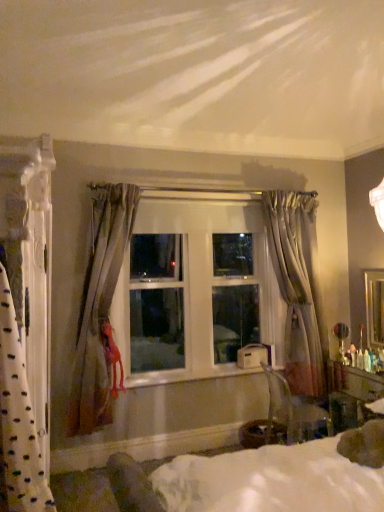
Question: Looking at their shapes, would you say silky beige curtain at center, which appears as the second curtain when viewed from the back, is wider or thinner than white fabric bed at center?

Choices:
 (A) wide
 (B) thin

Answer: (B)

Question: From a real-world perspective, is silky beige curtain at center, placed as the 2th curtain when sorted from left to right, above or below white fabric bed at center?

Choices:
 (A) below
 (B) above

Answer: (B)

Question: Which object is the closest to the metallic silver table lamp at right?

Choices:
 (A) wooden glossy vanity at lower right
 (B) sheer gray curtain at right, the first curtain positioned from the back
 (C) white textured curtain at left, which appears as the third curtain when viewed from the right
 (D) white fabric bed at center
 (E) transparent plastic chair at lower right

Answer: (A)

Question: Which of these objects is positioned farthest from the wooden glossy vanity at lower right?

Choices:
 (A) sheer gray curtain at right, which appears as the 1th curtain when viewed from the right
 (B) transparent plastic chair at lower right
 (C) white painted wood at center
 (D) white textured curtain at left, which is counted as the first curtain, starting from the left
 (E) metallic silver table lamp at right

Answer: (D)